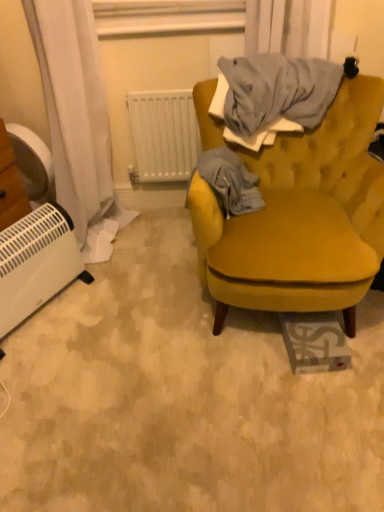
Measure the distance between point (53, 187) and camera.

Point (53, 187) and camera are 1.95 meters apart from each other.

You are a GUI agent. You are given a task and a screenshot of the screen. Output one action in this format:
    pyautogui.click(x=<x>, y=<y>)
    Task: Click on the velvet mustard yellow armchair at center
    The image size is (384, 512).
    Given the screenshot: What is the action you would take?
    pyautogui.click(x=309, y=217)

Where is `white plastic radiator at upper center`? This screenshot has height=512, width=384. white plastic radiator at upper center is located at coordinates (164, 134).

What do you see at coordinates (229, 182) in the screenshot?
I see `gray cotton blanket at upper right` at bounding box center [229, 182].

Where is `white plastic fan at left`? The width and height of the screenshot is (384, 512). white plastic fan at left is located at coordinates (33, 163).

From a real-world perspective, which object stands above the other?

From a 3D spatial view, gray cotton blanket at upper right is above.

From the image's perspective, is gray cotton blanket at upper right located above or below white plastic fan at left?

Based on their image positions, gray cotton blanket at upper right is located beneath white plastic fan at left.

Could you tell me if gray cotton blanket at upper right is turned towards white plastic fan at left?

No, gray cotton blanket at upper right is not oriented towards white plastic fan at left.

Which is farther from the camera, (257,189) or (36,181)?

→ The point (36,181) is more distant.

Could you tell me if white plastic heater at lower left is facing white plastic radiator at upper center?

No, white plastic heater at lower left is not aimed at white plastic radiator at upper center.

From the image's perspective, which is below, white plastic heater at lower left or white plastic radiator at upper center?

white plastic heater at lower left appears lower in the image.

Between white plastic heater at lower left and white plastic radiator at upper center, which one has more height?

white plastic radiator at upper center is taller.

Looking at the image, does white plastic heater at lower left seem bigger or smaller compared to white plastic radiator at upper center?

Clearly, white plastic heater at lower left is larger in size than white plastic radiator at upper center.

Is point (60, 246) positioned before point (29, 197)?

Yes, point (60, 246) is in front of point (29, 197).

Between white plastic heater at lower left and white plastic fan at left, which one has smaller width?

white plastic heater at lower left is thinner.

From a real-world perspective, between white plastic heater at lower left and white plastic fan at left, who is vertically lower?

white plastic heater at lower left is physically lower.

Considering the sizes of objects white plastic heater at lower left and white plastic fan at left in the image provided, who is bigger, white plastic heater at lower left or white plastic fan at left?

white plastic heater at lower left is bigger.

Considering their positions, is white plastic heater at lower left located in front of or behind velvet mustard yellow armchair at center?

Visually, white plastic heater at lower left is located behind velvet mustard yellow armchair at center.

Is velvet mustard yellow armchair at center completely or partially inside white plastic heater at lower left?

No, velvet mustard yellow armchair at center is located outside of white plastic heater at lower left.

From a real-world perspective, is white plastic heater at lower left positioned above or below velvet mustard yellow armchair at center?

In terms of real-world spatial position, white plastic heater at lower left is below velvet mustard yellow armchair at center.

Is white plastic radiator at upper center facing towards gray cotton blanket at upper right?

Yes, white plastic radiator at upper center is aimed at gray cotton blanket at upper right.

Where is `blanket that is on the right side of white plastic radiator at upper center`? This screenshot has width=384, height=512. blanket that is on the right side of white plastic radiator at upper center is located at coordinates (229, 182).

Who is bigger, white plastic radiator at upper center or gray cotton blanket at upper right?

gray cotton blanket at upper right.

From a real-world perspective, is white plastic radiator at upper center under velvet mustard yellow armchair at center?

Actually, white plastic radiator at upper center is physically above velvet mustard yellow armchair at center in the real world.

Can you confirm if white plastic radiator at upper center is bigger than velvet mustard yellow armchair at center?

No, white plastic radiator at upper center is not bigger than velvet mustard yellow armchair at center.

Based on the photo, are white plastic radiator at upper center and velvet mustard yellow armchair at center making contact?

white plastic radiator at upper center and velvet mustard yellow armchair at center are not in contact.

Considering the relative sizes of white plastic radiator at upper center and velvet mustard yellow armchair at center in the image provided, is white plastic radiator at upper center wider than velvet mustard yellow armchair at center?

No.

Does velvet mustard yellow armchair at center have a larger size compared to white plastic fan at left?

Correct, velvet mustard yellow armchair at center is larger in size than white plastic fan at left.

From the image's perspective, is velvet mustard yellow armchair at center positioned above or below white plastic fan at left?

velvet mustard yellow armchair at center is situated lower than white plastic fan at left in the image.

Does velvet mustard yellow armchair at center turn towards white plastic fan at left?

No, velvet mustard yellow armchair at center is not facing towards white plastic fan at left.

Image resolution: width=384 pixels, height=512 pixels. I want to click on blanket below the white plastic fan at left (from the image's perspective), so click(229, 182).

What are the coordinates of `radiator above the white plastic heater at lower left (from the image's perspective)` in the screenshot? It's located at (164, 134).

Based on the photo, which object lies further to the anchor point white plastic heater at lower left, white plastic fan at left or gray cotton blanket at upper right?

gray cotton blanket at upper right lies further to white plastic heater at lower left than the other object.

Considering their positions, is white plastic heater at lower left positioned closer to gray cotton blanket at upper right than white plastic radiator at upper center?

white plastic radiator at upper center is positioned closer to the anchor gray cotton blanket at upper right.

Based on their spatial positions, is velvet mustard yellow armchair at center or gray cotton blanket at upper right further from white plastic heater at lower left?

velvet mustard yellow armchair at center lies further to white plastic heater at lower left than the other object.

Considering their positions, is white plastic fan at left positioned further to velvet mustard yellow armchair at center than white plastic radiator at upper center?

The object further to velvet mustard yellow armchair at center is white plastic fan at left.

Estimate the real-world distances between objects in this image. Which object is closer to velvet mustard yellow armchair at center, white plastic radiator at upper center or white plastic fan at left?

The object closer to velvet mustard yellow armchair at center is white plastic radiator at upper center.

When comparing their distances from gray cotton blanket at upper right, does velvet mustard yellow armchair at center or white plastic fan at left seem further?

The object further to gray cotton blanket at upper right is white plastic fan at left.

Considering their positions, is white plastic radiator at upper center positioned further to velvet mustard yellow armchair at center than gray cotton blanket at upper right?

The object further to velvet mustard yellow armchair at center is white plastic radiator at upper center.

Estimate the real-world distances between objects in this image. Which object is closer to gray cotton blanket at upper right, white plastic heater at lower left or white plastic fan at left?

white plastic heater at lower left lies closer to gray cotton blanket at upper right than the other object.

Where is `radiator situated between white plastic fan at left and gray cotton blanket at upper right from left to right`? The image size is (384, 512). radiator situated between white plastic fan at left and gray cotton blanket at upper right from left to right is located at coordinates (164, 134).

Locate an element on the screen. Image resolution: width=384 pixels, height=512 pixels. appliance located between white plastic fan at left and white plastic radiator at upper center in the left-right direction is located at coordinates (36, 263).

I want to click on appliance situated between white plastic fan at left and velvet mustard yellow armchair at center from left to right, so click(x=36, y=263).

In order to click on appliance located between white plastic fan at left and gray cotton blanket at upper right in the left-right direction in this screenshot , I will do `click(36, 263)`.